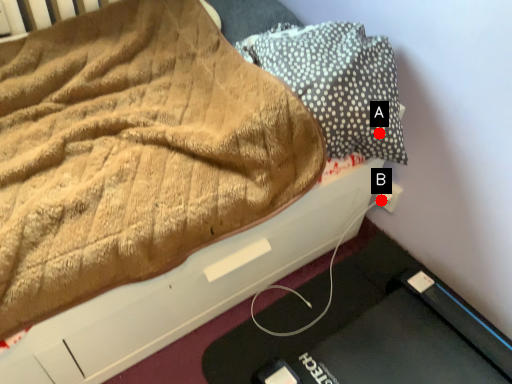
Question: Two points are circled on the image, labeled by A and B beside each circle. Which point is closer to the camera?

Choices:
 (A) A is closer
 (B) B is closer

Answer: (A)